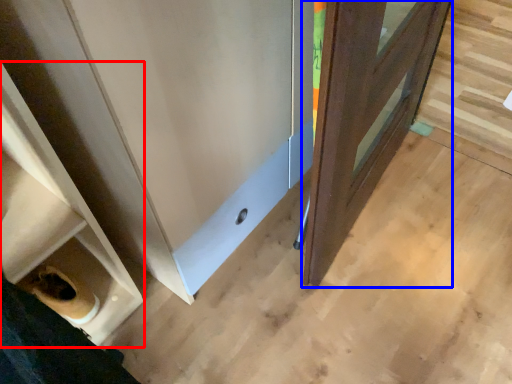
Question: Among these objects, which one is nearest to the camera, shelf (highlighted by a red box) or door (highlighted by a blue box)?

Choices:
 (A) shelf
 (B) door

Answer: (A)